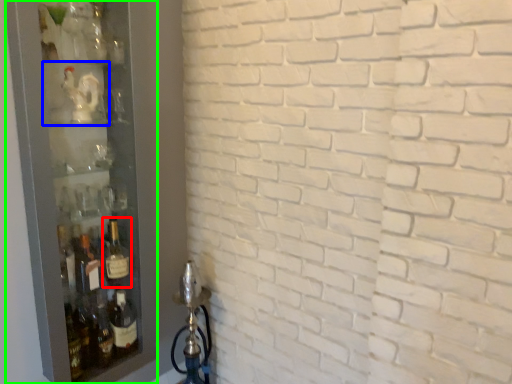
Question: Considering the real-world distances, which object is closest to bottle (highlighted by a red box)? shelf (highlighted by a blue box) or glass door (highlighted by a green box).

Choices:
 (A) shelf
 (B) glass door

Answer: (B)